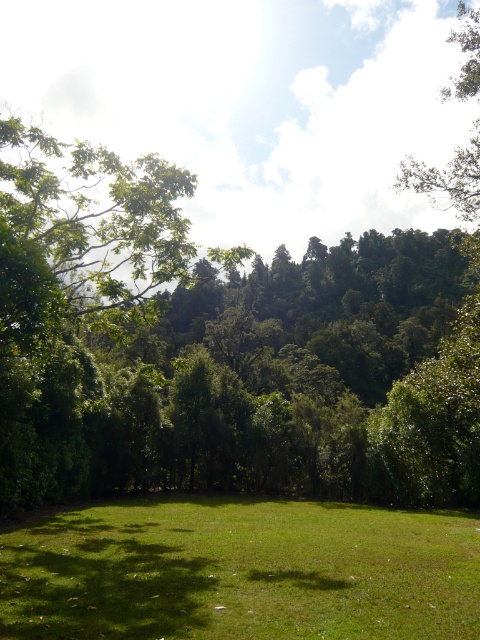
Question: Does green grass at center have a lesser width compared to green leafy tree at upper right?

Choices:
 (A) yes
 (B) no

Answer: (A)

Question: Is green grass at center below green leafy tree at upper right?

Choices:
 (A) no
 (B) yes

Answer: (B)

Question: Which point appears farthest from the camera in this image?

Choices:
 (A) (242, 628)
 (B) (468, 10)

Answer: (B)

Question: Does green grass at center appear on the left side of green leafy tree at upper right?

Choices:
 (A) yes
 (B) no

Answer: (A)

Question: Which object is closer to the camera taking this photo?

Choices:
 (A) green grass at center
 (B) green leafy tree at upper right

Answer: (A)